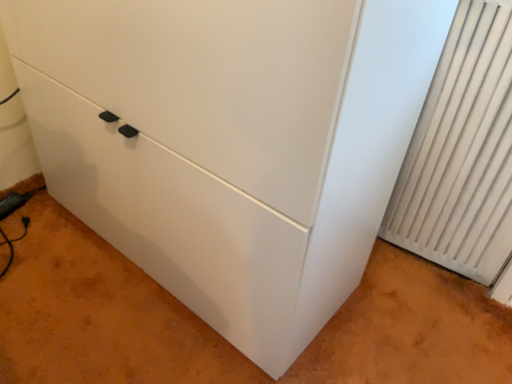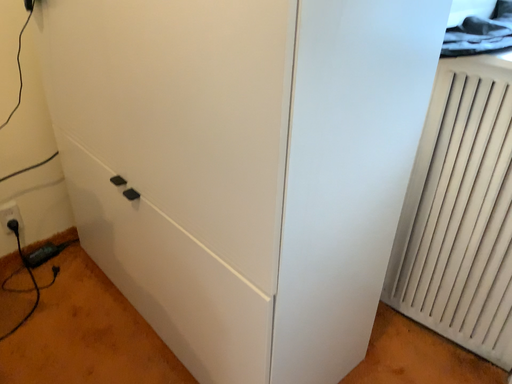
Question: How did the camera likely rotate when shooting the video?

Choices:
 (A) rotated upward
 (B) rotated downward

Answer: (A)